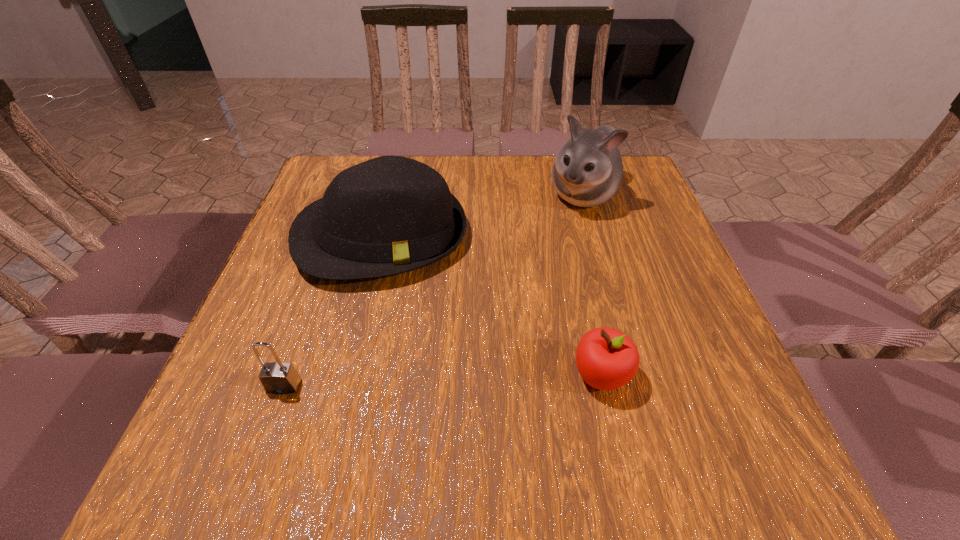
At what (x,y) coordinates should I click in order to perform the action: click on padlock. Please return your answer as a coordinate pair (x, y). The height and width of the screenshot is (540, 960). Looking at the image, I should click on (278, 377).

Locate an element on the screen. The height and width of the screenshot is (540, 960). apple is located at coordinates 606,358.

You are a GUI agent. You are given a task and a screenshot of the screen. Output one action in this format:
    pyautogui.click(x=<x>, y=<y>)
    Task: Click on the tallest object
    
    Given the screenshot: What is the action you would take?
    pyautogui.click(x=588, y=170)

At what (x,y) coordinates should I click in order to perform the action: click on the third shortest object. Please return your answer as a coordinate pair (x, y). Image resolution: width=960 pixels, height=540 pixels. Looking at the image, I should click on (389, 215).

Find the location of a particular element. This screenshot has width=960, height=540. vacant space situated 0.330m on the back of the apple is located at coordinates (570, 236).

The height and width of the screenshot is (540, 960). Identify the location of vacant area situated 0.110m on the face of the tallest object. (554, 242).

Locate an element on the screen. vacant region located 0.180m on the face of the tallest object is located at coordinates (541, 260).

Find the location of a particular element. blank space located 0.280m on the face of the tallest object is located at coordinates (522, 288).

Identify the location of vacant space located 0.220m on the front-facing side of the fedora. (418, 375).

Identify the location of free point located on the front-facing side of the fedora. (415, 361).